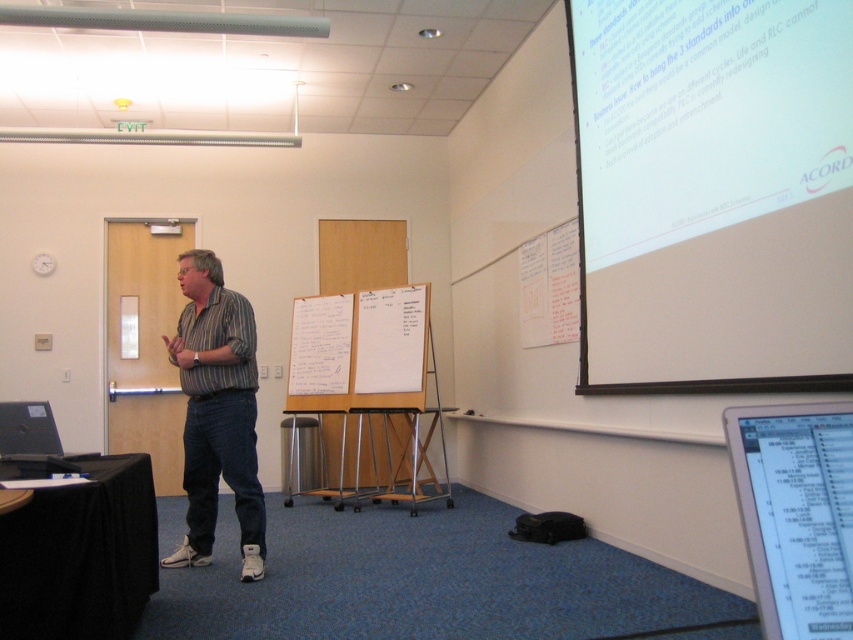
You are standing at the position of point (250, 429) and want to walk to the door located at the back of the room. However, there is a presenter at point (660, 250). Can you walk directly to the door without passing in front of the presenter?

Point (660, 250) is in front of point (250, 429), so if you are at point (250, 429) and want to go to the door at the back, you would have to walk past the presenter at point (660, 250) who is blocking your path.

Where is the black glossy screen at lower right located in the image?

The black glossy screen at lower right is located at point coordinates of (x=798, y=518).